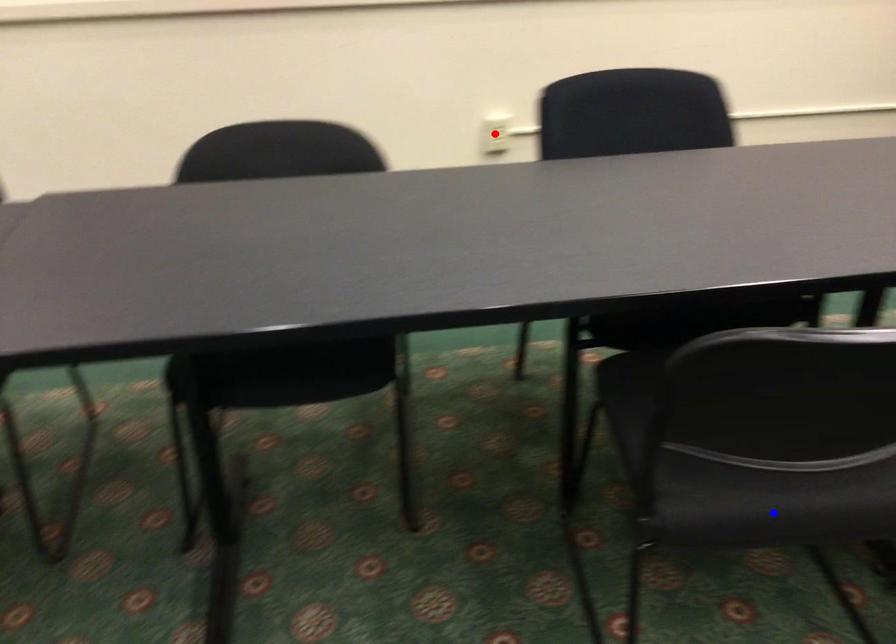
Question: Two points are marked on the image. Which point is closer to the camera?

Choices:
 (A) Blue point is closer.
 (B) Red point is closer.

Answer: (A)